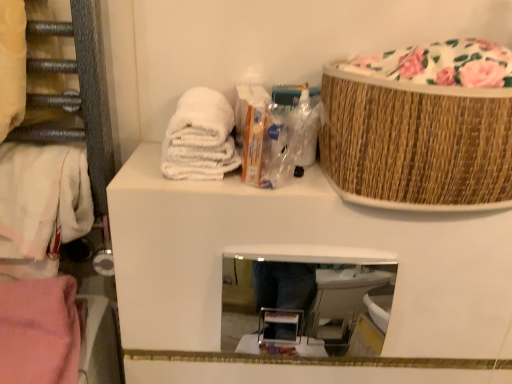
Question: Can you confirm if bamboo textured basket at upper right is smaller than white cotton towel at left?

Choices:
 (A) yes
 (B) no

Answer: (B)

Question: Does bamboo textured basket at upper right appear on the right side of white cotton towel at left?

Choices:
 (A) yes
 (B) no

Answer: (A)

Question: Is bamboo textured basket at upper right positioned far away from white cotton towel at left?

Choices:
 (A) no
 (B) yes

Answer: (A)

Question: Considering the relative positions of bamboo textured basket at upper right and white cotton towel at left in the image provided, is bamboo textured basket at upper right to the left of white cotton towel at left from the viewer's perspective?

Choices:
 (A) yes
 (B) no

Answer: (B)

Question: Is bamboo textured basket at upper right beside white cotton towel at left?

Choices:
 (A) no
 (B) yes

Answer: (A)

Question: Relative to white towel at upper left, which is counted as the 1th material, starting from the top, is white cotton towel at left in front or behind?

Choices:
 (A) behind
 (B) front

Answer: (A)

Question: Considering the relative positions of white cotton towel at left and white towel at upper left, the 1th material positioned from the right, in the image provided, is white cotton towel at left to the left or to the right of white towel at upper left, the 1th material positioned from the right,?

Choices:
 (A) left
 (B) right

Answer: (A)

Question: Is point tap(22, 211) closer or farther from the camera than point tap(202, 94)?

Choices:
 (A) farther
 (B) closer

Answer: (B)

Question: From the image's perspective, is white cotton towel at left located above or below white towel at upper left, the 1th material positioned from the right?

Choices:
 (A) above
 (B) below

Answer: (B)

Question: Choose the correct answer: Is bamboo textured basket at upper right inside clear glass mirror at center or outside it?

Choices:
 (A) outside
 (B) inside

Answer: (A)

Question: Considering the positions of bamboo textured basket at upper right and clear glass mirror at center in the image, is bamboo textured basket at upper right wider or thinner than clear glass mirror at center?

Choices:
 (A) thin
 (B) wide

Answer: (B)

Question: Is bamboo textured basket at upper right taller or shorter than clear glass mirror at center?

Choices:
 (A) short
 (B) tall

Answer: (B)

Question: From a real-world perspective, is bamboo textured basket at upper right positioned above or below clear glass mirror at center?

Choices:
 (A) above
 (B) below

Answer: (A)

Question: Visually, is white towel at upper left, the 1th material positioned from the right, positioned to the left or to the right of bamboo textured basket at upper right?

Choices:
 (A) right
 (B) left

Answer: (B)

Question: Looking at their shapes, would you say white towel at upper left, which is counted as the 1th material, starting from the top, is wider or thinner than bamboo textured basket at upper right?

Choices:
 (A) wide
 (B) thin

Answer: (B)